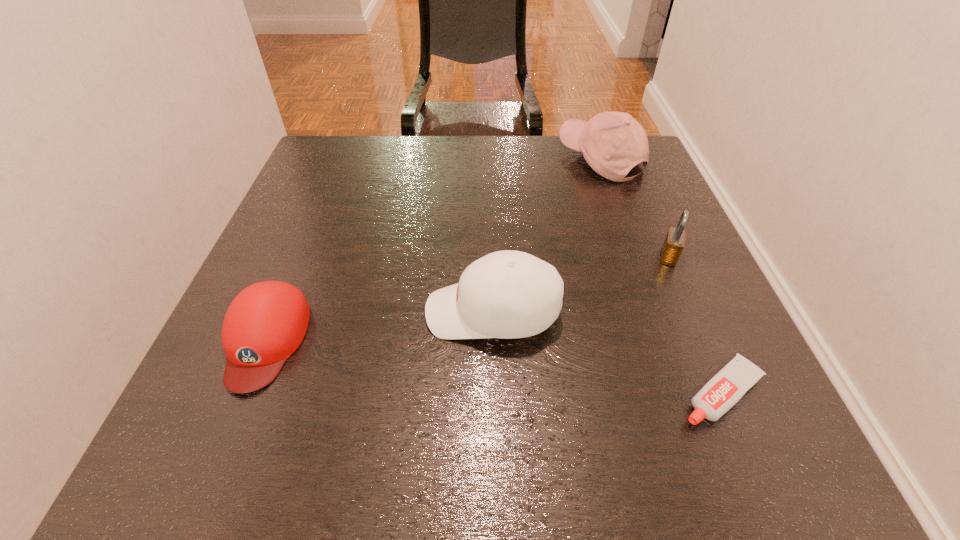
The image size is (960, 540). Find the location of `unoccupied position between the padlock and the farthest baseball cap`. unoccupied position between the padlock and the farthest baseball cap is located at coordinates (635, 207).

At what (x,y) coordinates should I click in order to perform the action: click on object that is the fourth nearest to the leftmost object. Please return your answer as a coordinate pair (x, y). The height and width of the screenshot is (540, 960). Looking at the image, I should click on (674, 242).

Locate which object is the third closest to the fourth nearest object. Please provide its 2D coordinates. Your answer should be formatted as a tuple, i.e. [(x, y)], where the tuple contains the x and y coordinates of a point satisfying the conditions above.

[(612, 143)]

At what (x,y) coordinates should I click in order to perform the action: click on baseball cap that is the closest to the second farthest object. Please return your answer as a coordinate pair (x, y). Looking at the image, I should click on (507, 294).

Locate which baseball cap is the second closest to the farthest object. Please provide its 2D coordinates. Your answer should be formatted as a tuple, i.e. [(x, y)], where the tuple contains the x and y coordinates of a point satisfying the conditions above.

[(265, 324)]

What are the coordinates of `vacant area that satisfies the following two spatial constraints: 1. on the front-facing side of the rightmost baseball cap; 2. on the left side of the toothpaste` in the screenshot? It's located at (684, 393).

Find the location of a particular element. The height and width of the screenshot is (540, 960). vacant space that satisfies the following two spatial constraints: 1. on the front-facing side of the farthest baseball cap; 2. on the left side of the padlock is located at coordinates (636, 256).

This screenshot has width=960, height=540. Find the location of `free space that satisfies the following two spatial constraints: 1. on the front-facing side of the farthest object; 2. on the right side of the padlock`. free space that satisfies the following two spatial constraints: 1. on the front-facing side of the farthest object; 2. on the right side of the padlock is located at coordinates (636, 256).

At what (x,y) coordinates should I click in order to perform the action: click on vacant space that satisfies the following two spatial constraints: 1. on the front-facing side of the padlock; 2. on the left side of the farthest object. Please return your answer as a coordinate pair (x, y). Image resolution: width=960 pixels, height=540 pixels. Looking at the image, I should click on (636, 256).

The image size is (960, 540). I want to click on free point that satisfies the following two spatial constraints: 1. on the front-facing side of the shortest object; 2. on the left side of the rightmost baseball cap, so click(684, 393).